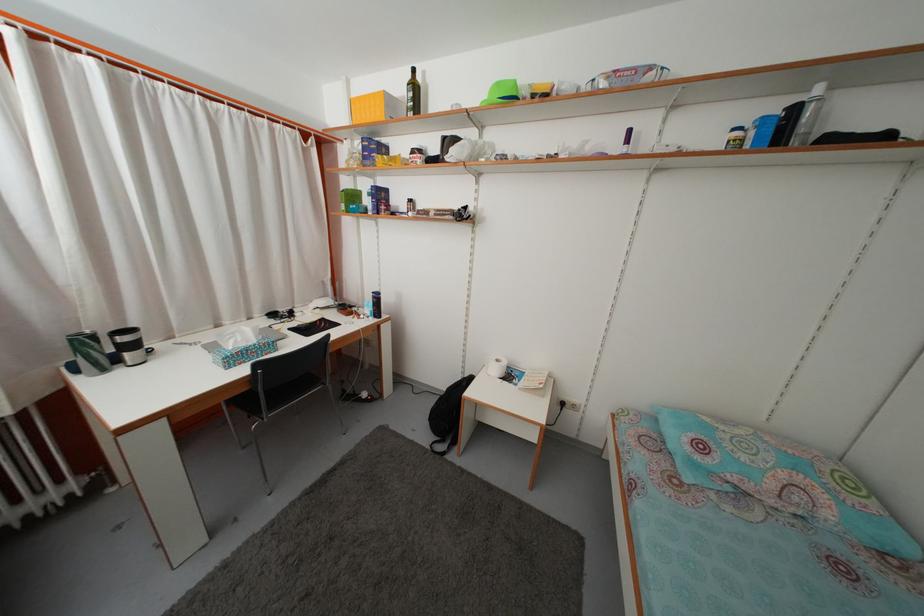
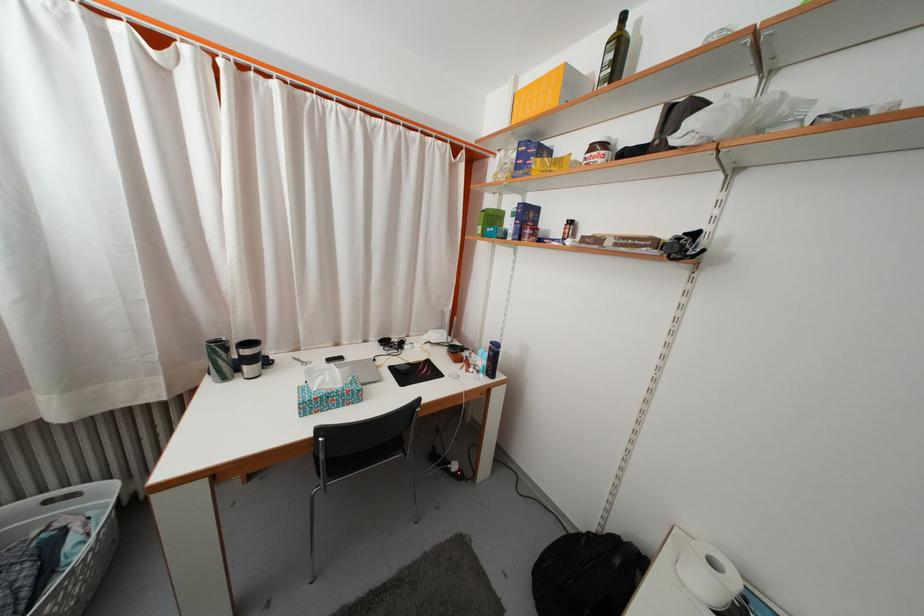
The point at (371, 310) is marked in the first image. Where is the corresponding point in the second image?

(485, 359)